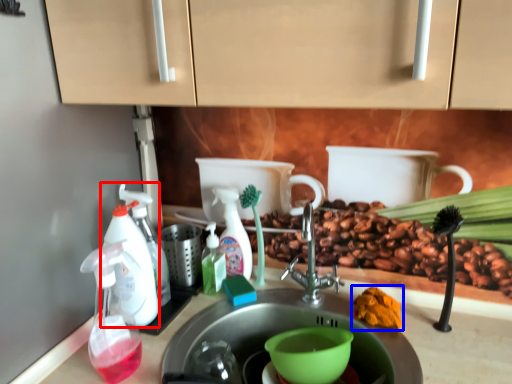
Question: Which point is closer to the camera, soap dispenser (highlighted by a red box) or debris (highlighted by a blue box)?

Choices:
 (A) soap dispenser
 (B) debris

Answer: (A)